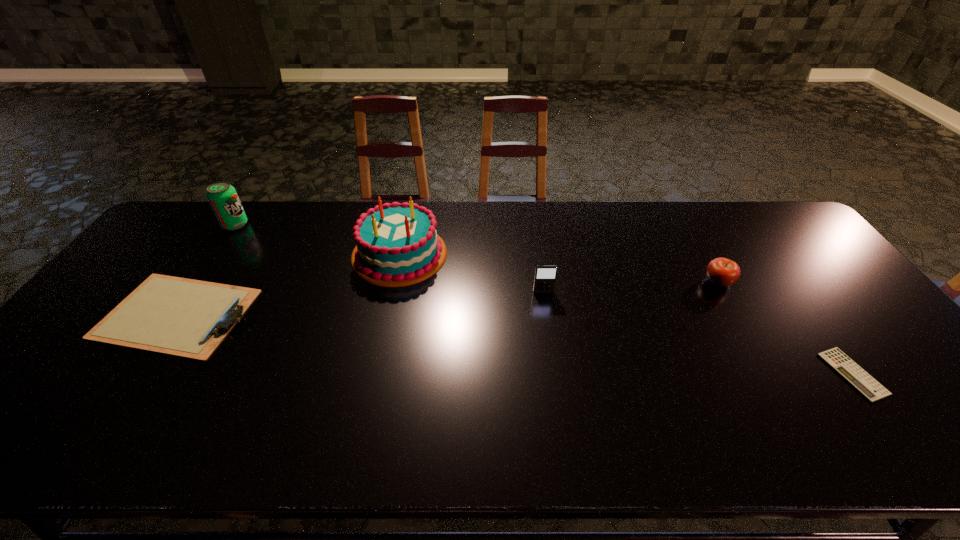
At what (x,y) coordinates should I click in order to perform the action: click on vacant area that lies between the apple and the clipboard. Please return your answer as a coordinate pair (x, y). The height and width of the screenshot is (540, 960). Looking at the image, I should click on (447, 298).

Identify the location of object that is the fourth closest to the fourth object from left to right. This screenshot has width=960, height=540. (188, 318).

Locate an element on the screen. object that is the third closest one to the second shortest object is located at coordinates (545, 276).

The height and width of the screenshot is (540, 960). Find the location of `vacant space that satisfies the following two spatial constraints: 1. on the front-facing side of the fifth shortest object; 2. on the right side of the clipboard`. vacant space that satisfies the following two spatial constraints: 1. on the front-facing side of the fifth shortest object; 2. on the right side of the clipboard is located at coordinates (175, 314).

At what (x,y) coordinates should I click in order to perform the action: click on free region that satisfies the following two spatial constraints: 1. on the front-facing side of the iPod; 2. on the right side of the rightmost object. Please return your answer as a coordinate pair (x, y). Looking at the image, I should click on (556, 374).

You are a GUI agent. You are given a task and a screenshot of the screen. Output one action in this format:
    pyautogui.click(x=<x>, y=<y>)
    Task: Click on the free location that satisfies the following two spatial constraints: 1. on the front-facing side of the calculator; 2. on the right side of the fifth shortest object
    This screenshot has height=540, width=960.
    Given the screenshot: What is the action you would take?
    pyautogui.click(x=133, y=374)

Locate an element on the screen. vacant space that satisfies the following two spatial constraints: 1. on the front-facing side of the fifth shortest object; 2. on the left side of the calculator is located at coordinates (133, 374).

Locate an element on the screen. This screenshot has height=540, width=960. free spot that satisfies the following two spatial constraints: 1. on the front side of the calculator; 2. on the right side of the fifth object from left to right is located at coordinates [771, 374].